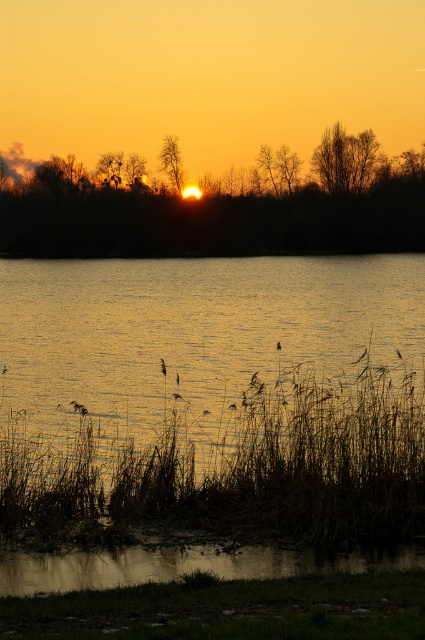
Where is `brown grass at lower center`? The image size is (425, 640). brown grass at lower center is located at coordinates (235, 467).

Who is more distant from viewer, (x=99, y=467) or (x=278, y=342)?

The point (x=99, y=467) is more distant.

Who is more forward, (294, 525) or (275, 348)?

Point (294, 525)

You are a GUI agent. You are given a task and a screenshot of the screen. Output one action in this format:
    pyautogui.click(x=<x>, y=<y>)
    Task: Click on the brown grass at lower center
    The width and height of the screenshot is (425, 640).
    Given the screenshot: What is the action you would take?
    pyautogui.click(x=235, y=467)